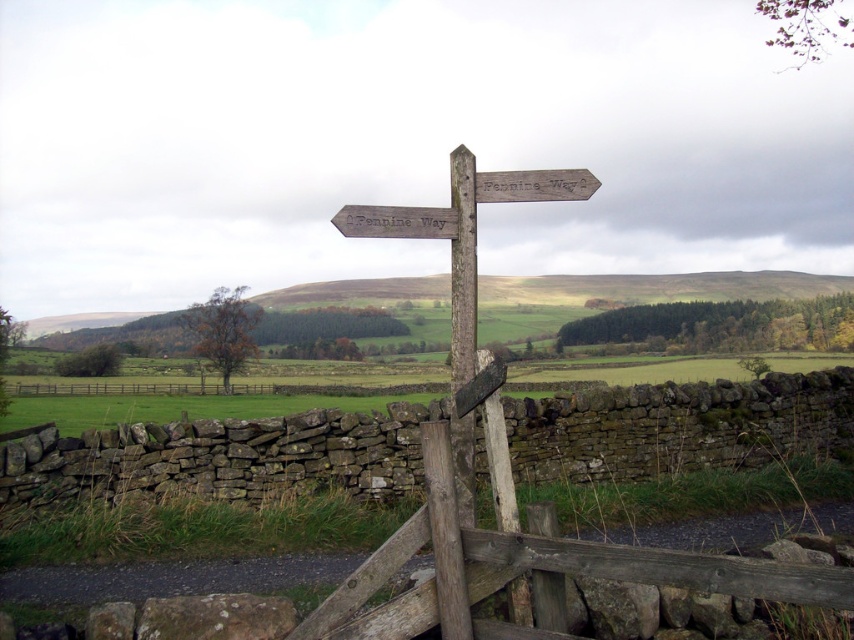
Question: Is weathered wood signpost at center further to the viewer compared to brown wooden fence at lower left?

Choices:
 (A) no
 (B) yes

Answer: (A)

Question: Which of the following is the closest to the observer?

Choices:
 (A) (260, 384)
 (B) (465, 465)

Answer: (B)

Question: Can you confirm if weathered wood signpost at center is thinner than brown wooden fence at lower left?

Choices:
 (A) no
 (B) yes

Answer: (B)

Question: Does weathered wood signpost at center appear under brown wooden fence at lower left?

Choices:
 (A) yes
 (B) no

Answer: (B)

Question: Which of the following is the farthest from the observer?

Choices:
 (A) brown wooden fence at lower left
 (B) weathered wood signpost at center

Answer: (A)